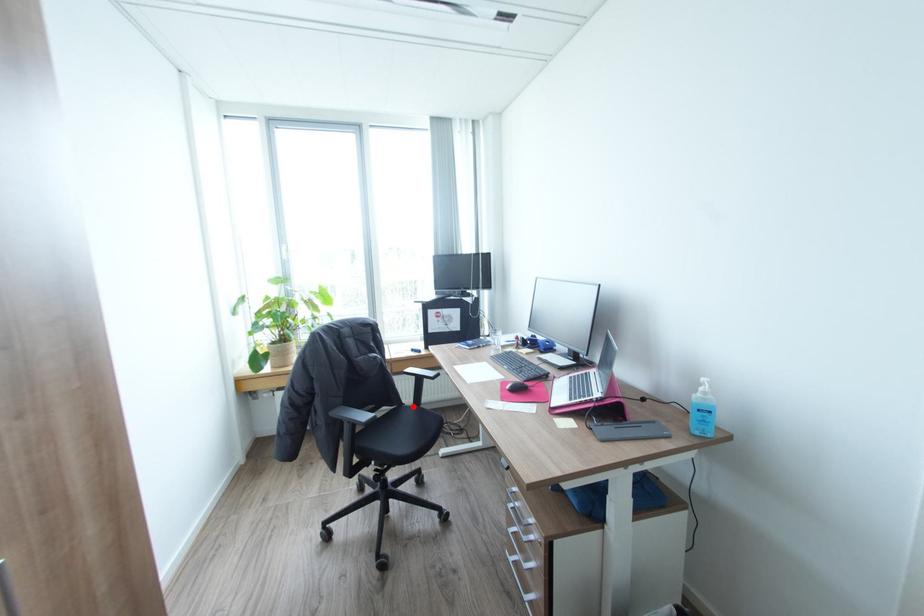
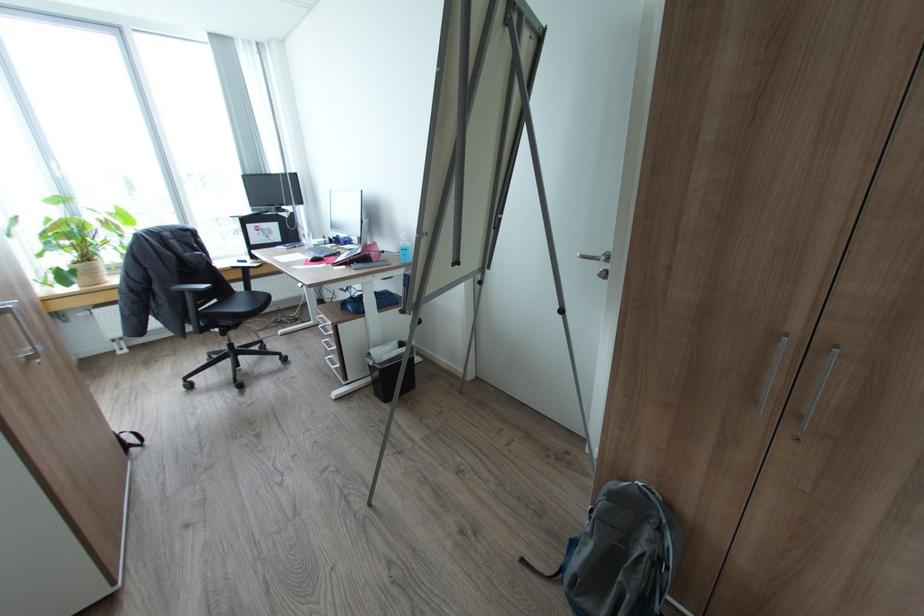
Locate, in the second image, the point that corresponds to the highlighted location in the first image.

(246, 292)